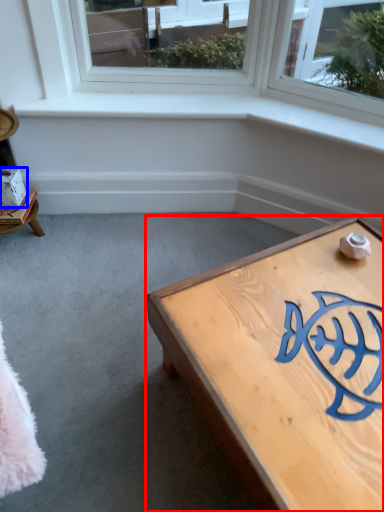
Question: Which object is further to the camera taking this photo, coffee table (highlighted by a red box) or box (highlighted by a blue box)?

Choices:
 (A) coffee table
 (B) box

Answer: (B)